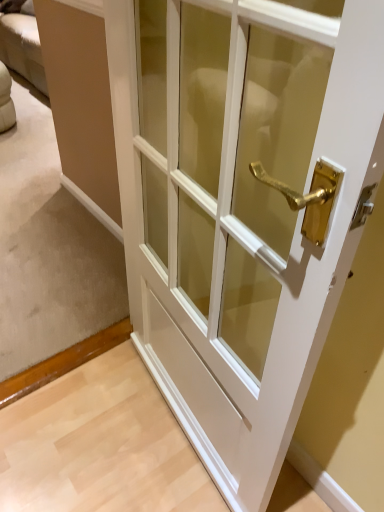
Question: Should I look upward or downward to see white wood door at center?

Choices:
 (A) down
 (B) up

Answer: (A)